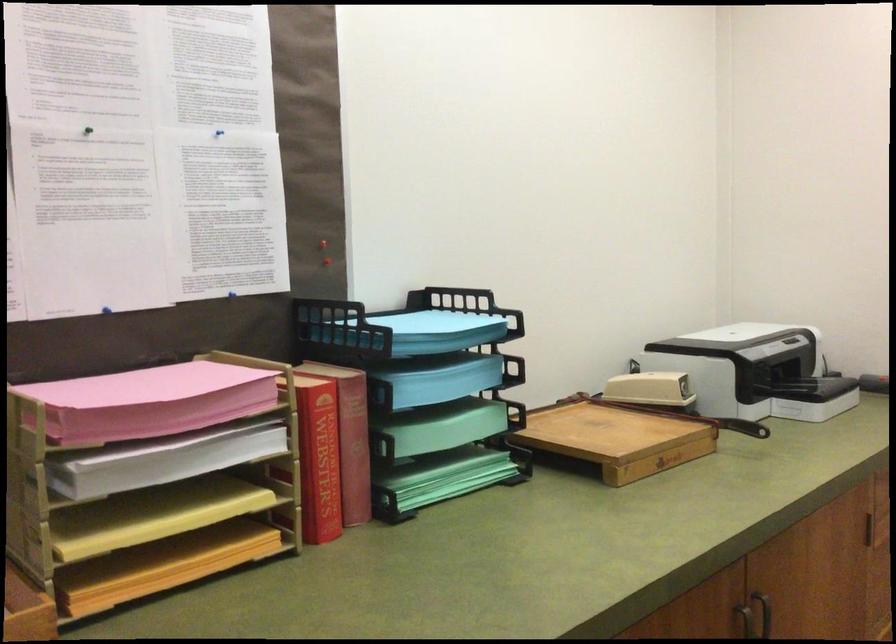
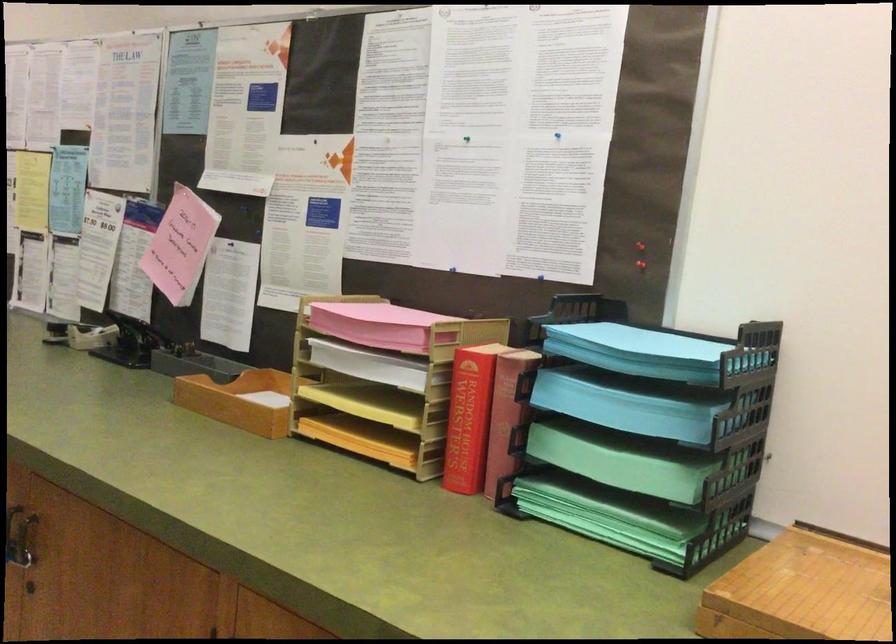
In the second image, find the point that corresponds to (204,398) in the first image.

(383, 325)